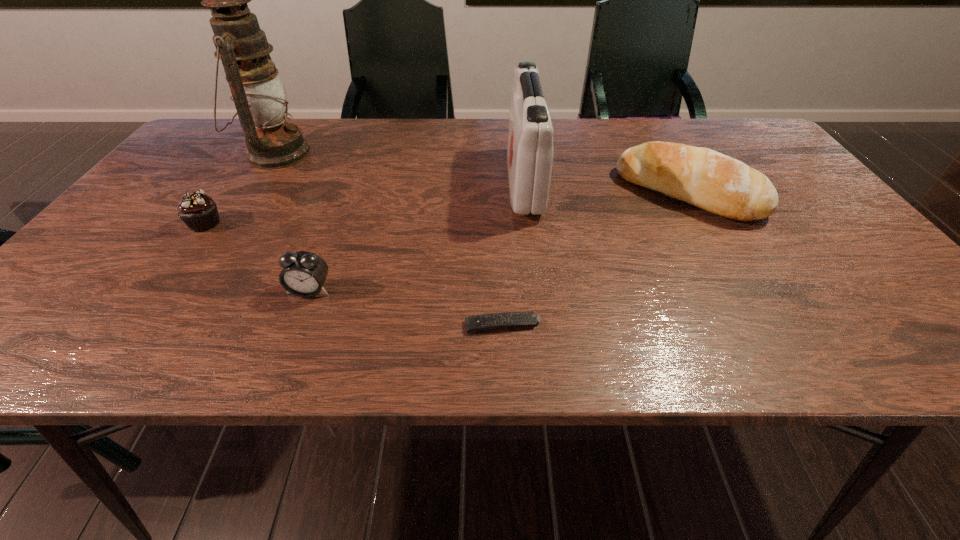
Where is `free spot between the tallest object and the remote control`? This screenshot has height=540, width=960. free spot between the tallest object and the remote control is located at coordinates click(390, 239).

Identify the location of vacant area that lies between the second nearest object and the lantern. This screenshot has width=960, height=540. (293, 221).

Locate an element on the screen. vacant point located between the cupcake and the tallest object is located at coordinates (240, 188).

Locate an element on the screen. The width and height of the screenshot is (960, 540). vacant area that lies between the cupcake and the shortest object is located at coordinates (354, 274).

Where is `vacant area that lies between the fifth farthest object and the cupcake`? This screenshot has height=540, width=960. vacant area that lies between the fifth farthest object and the cupcake is located at coordinates (257, 257).

Locate an element on the screen. Image resolution: width=960 pixels, height=540 pixels. empty space that is in between the third object from left to right and the rightmost object is located at coordinates (498, 241).

Where is `free area in between the cupcake and the lantern`? free area in between the cupcake and the lantern is located at coordinates (240, 188).

Where is `vacant point located between the lantern and the cupcake`? Image resolution: width=960 pixels, height=540 pixels. vacant point located between the lantern and the cupcake is located at coordinates (240, 188).

You are a GUI agent. You are given a task and a screenshot of the screen. Output one action in this format:
    pyautogui.click(x=<x>, y=<y>)
    Task: Click on the unoccupied area between the bread and the cupcake
    Image resolution: width=960 pixels, height=540 pixels.
    Given the screenshot: What is the action you would take?
    pyautogui.click(x=446, y=208)

Select which object appears as the fourth closest to the remote control. Please provide its 2D coordinates. Your answer should be formatted as a tuple, i.e. [(x, y)], where the tuple contains the x and y coordinates of a point satisfying the conditions above.

[(198, 211)]